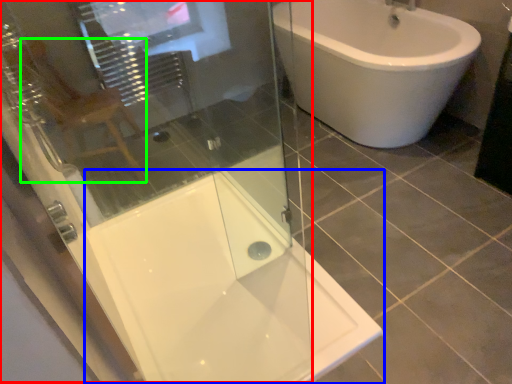
Question: Which object is positioned farthest from screen door (highlighted by a red box)? Select from bath (highlighted by a blue box) and gray (highlighted by a green box).

Choices:
 (A) bath
 (B) gray

Answer: (B)